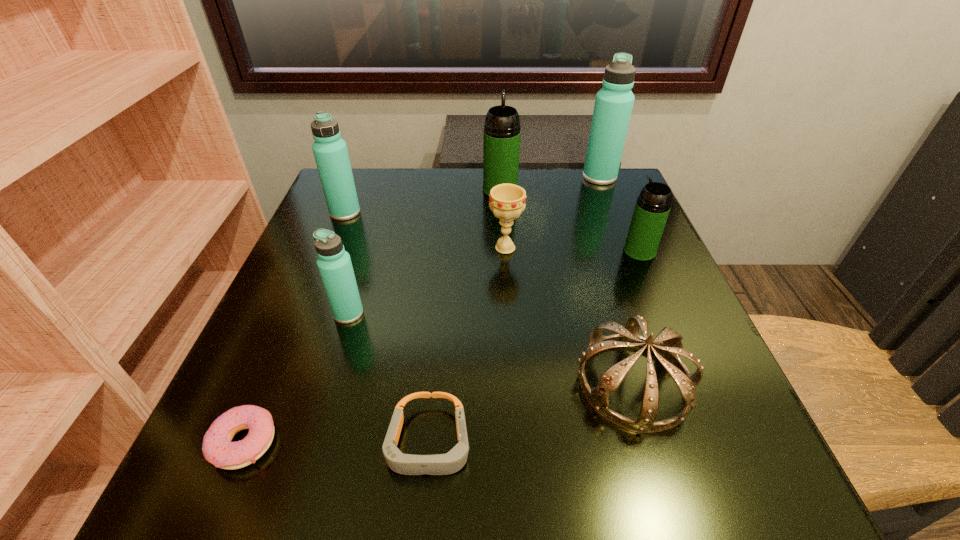
At what (x,y) coordinates should I click in order to perform the action: click on chalice. Please return your answer as a coordinate pair (x, y). This screenshot has height=540, width=960. Looking at the image, I should click on (507, 201).

At what (x,y) coordinates should I click in order to perform the action: click on brown tiara. Please return your answer as a coordinate pair (x, y). Image resolution: width=960 pixels, height=540 pixels. Looking at the image, I should click on (667, 346).

Find the location of a particular element. This screenshot has width=960, height=540. the third shortest object is located at coordinates (667, 346).

Locate an element on the screen. Image resolution: width=960 pixels, height=540 pixels. goggles is located at coordinates (440, 464).

Where is `pink doughnut`? The image size is (960, 540). pink doughnut is located at coordinates (217, 448).

Locate an element on the screen. vacant area situated 0.390m on the left of the tallest object is located at coordinates (437, 177).

You are a GUI agent. You are given a task and a screenshot of the screen. Output one action in this format:
    pyautogui.click(x=<x>, y=<y>)
    Task: Click on the free location located 0.380m on the right of the leftmost aqua thermos bottle
    Image resolution: width=960 pixels, height=540 pixels.
    Given the screenshot: What is the action you would take?
    pyautogui.click(x=519, y=212)

The height and width of the screenshot is (540, 960). Find the location of `vacant region located 0.390m on the right of the nearest thermos bottle`. vacant region located 0.390m on the right of the nearest thermos bottle is located at coordinates point(576,313).

Identify the location of vacant region located 0.250m from the spout of the smaller green thermos bottle. Image resolution: width=960 pixels, height=540 pixels. (507, 251).

This screenshot has height=540, width=960. In order to click on vacant space located from the spout of the smaller green thermos bottle in this screenshot , I will do `click(507, 251)`.